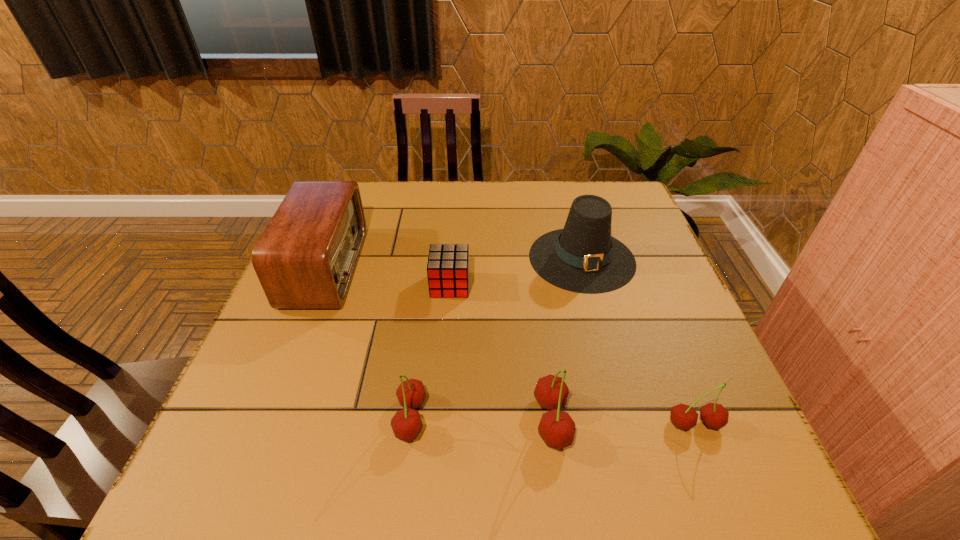
The width and height of the screenshot is (960, 540). What are the coordinates of `free space located on the surface of the second cherry from left to right` in the screenshot? It's located at (496, 421).

The image size is (960, 540). I want to click on free space located on the surface of the second cherry from left to right, so click(442, 421).

The image size is (960, 540). I want to click on free region located 0.200m on the surface of the second cherry from left to right, so click(425, 421).

I want to click on free point located 0.350m on the front-facing side of the hat, so click(628, 428).

Locate an element on the screen. The image size is (960, 540). vacant space situated 0.400m on the front panel of the leftmost object is located at coordinates (512, 268).

I want to click on vacant space located on the back of the shortest object, so click(x=456, y=200).

The height and width of the screenshot is (540, 960). Identify the location of object at the left edge. click(x=305, y=259).

Locate an element on the screen. Image resolution: width=960 pixels, height=540 pixels. cherry located in the right edge section of the desktop is located at coordinates (713, 415).

At what (x,y) coordinates should I click in order to perform the action: click on hat present at the right edge. Please return your answer as a coordinate pair (x, y). The height and width of the screenshot is (540, 960). Looking at the image, I should click on [x=583, y=257].

Locate an element on the screen. object located in the near right corner section of the desktop is located at coordinates (713, 415).